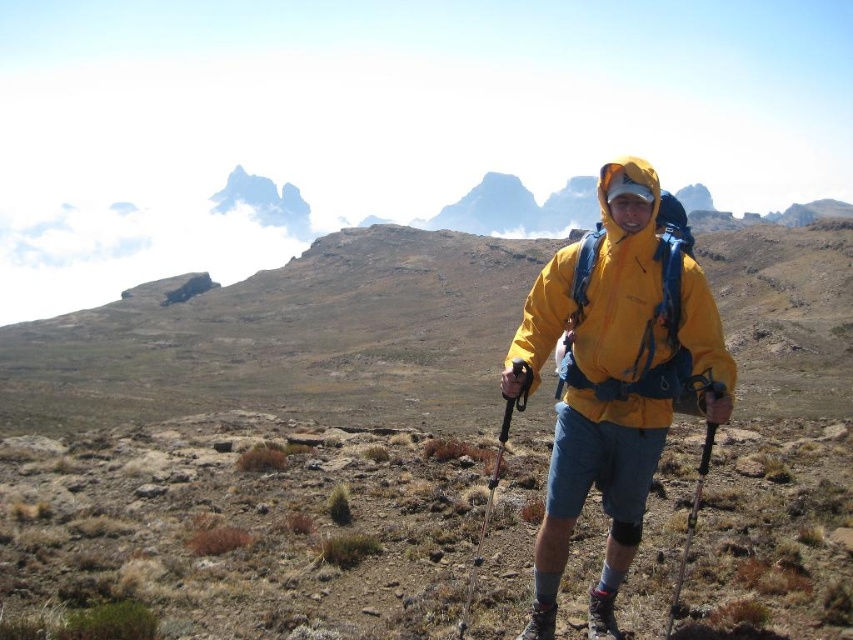
Question: Which is nearer to the black plastic ski pole at lower right?

Choices:
 (A) brushed leather hiking boot at lower center
 (B) metallic silver ski pole at center
 (C) matte black hiking boot at lower center
 (D) yellow waterproof jacket at center

Answer: (A)

Question: Which point is closer to the camera?

Choices:
 (A) (589, 628)
 (B) (692, 497)

Answer: (A)

Question: Is brushed leather hiking boot at lower center smaller than matte black hiking boot at lower center?

Choices:
 (A) yes
 (B) no

Answer: (B)

Question: Is brushed leather hiking boot at lower center wider than matte black hiking boot at lower center?

Choices:
 (A) yes
 (B) no

Answer: (B)

Question: Is brushed leather hiking boot at lower center bigger than matte black hiking boot at lower center?

Choices:
 (A) yes
 (B) no

Answer: (A)

Question: Among these objects, which one is nearest to the camera?

Choices:
 (A) brushed leather hiking boot at lower center
 (B) yellow waterproof jacket at center
 (C) matte black hiking boot at lower center

Answer: (B)